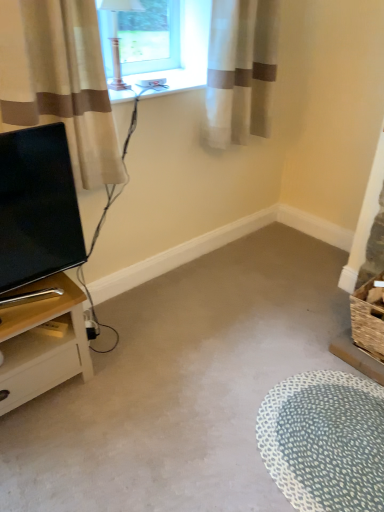
Identify the location of vacant space to the right of light wood nightstand at left. The image size is (384, 512). (117, 384).